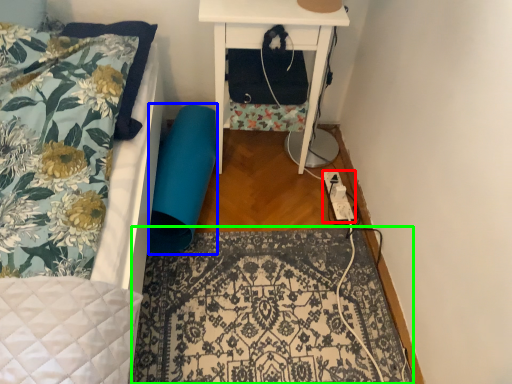
Question: Considering the real-world distances, which object is closest to extension cord (highlighted by a red box)? swivel chair (highlighted by a blue box) or mat (highlighted by a green box).

Choices:
 (A) swivel chair
 (B) mat

Answer: (B)